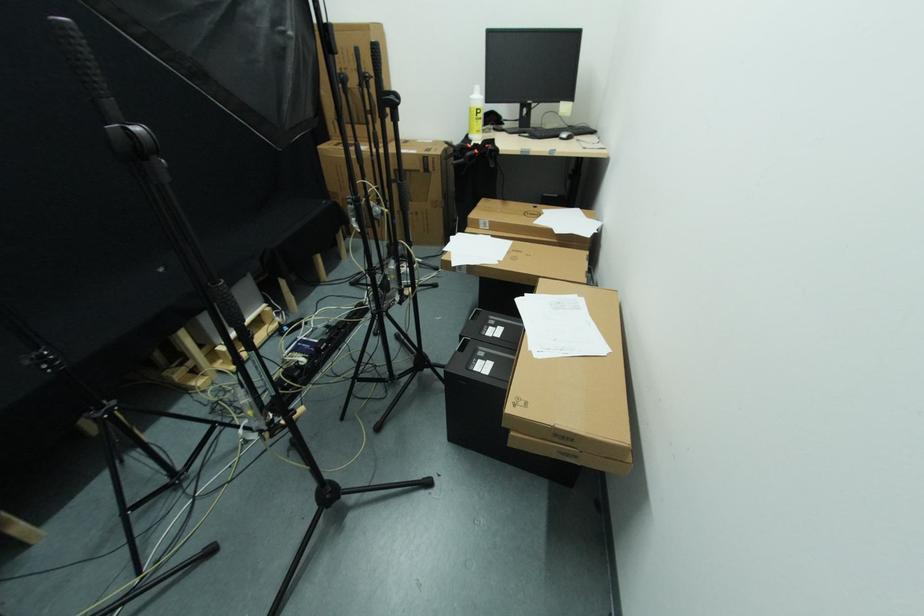
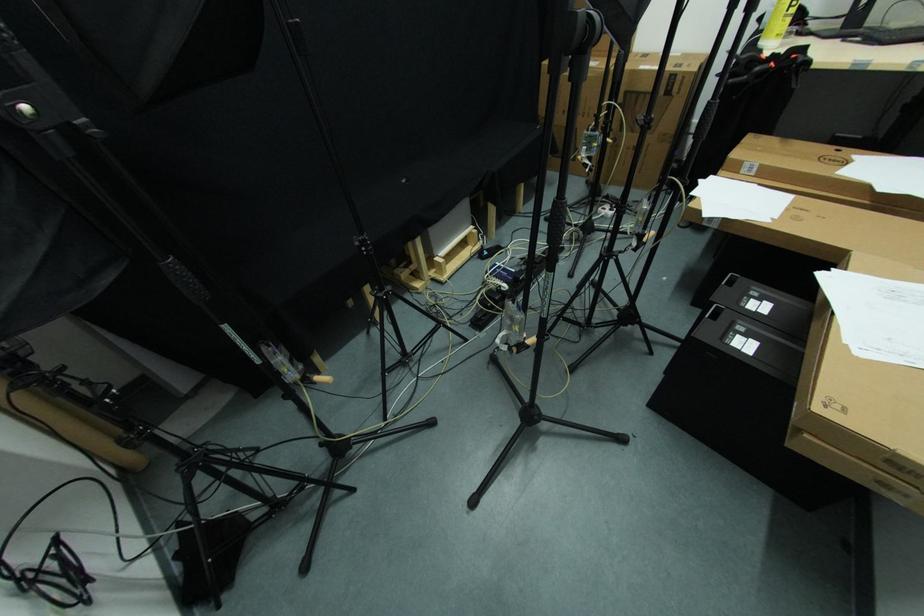
Where in the second image is the point corresponding to point (528, 406) from the first image?

(848, 413)